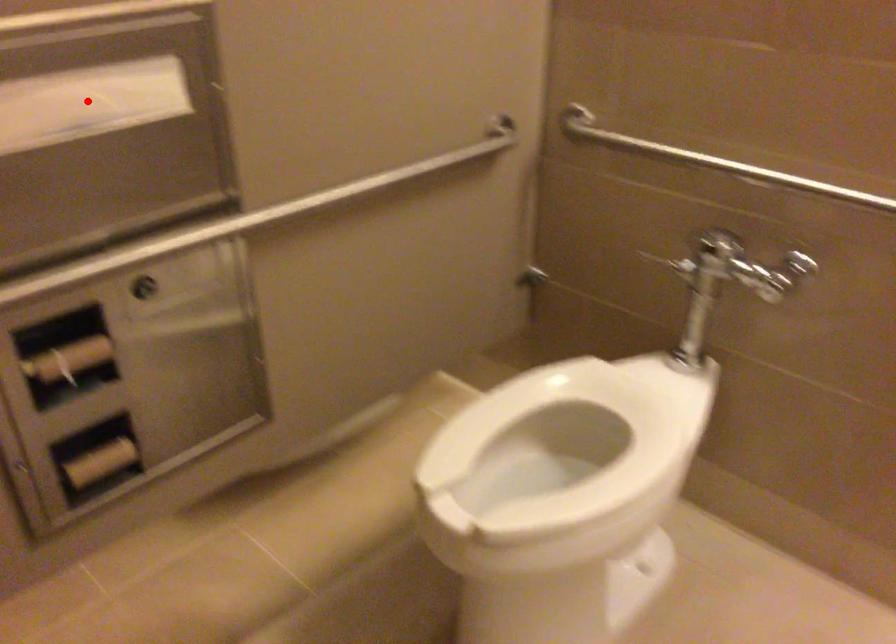
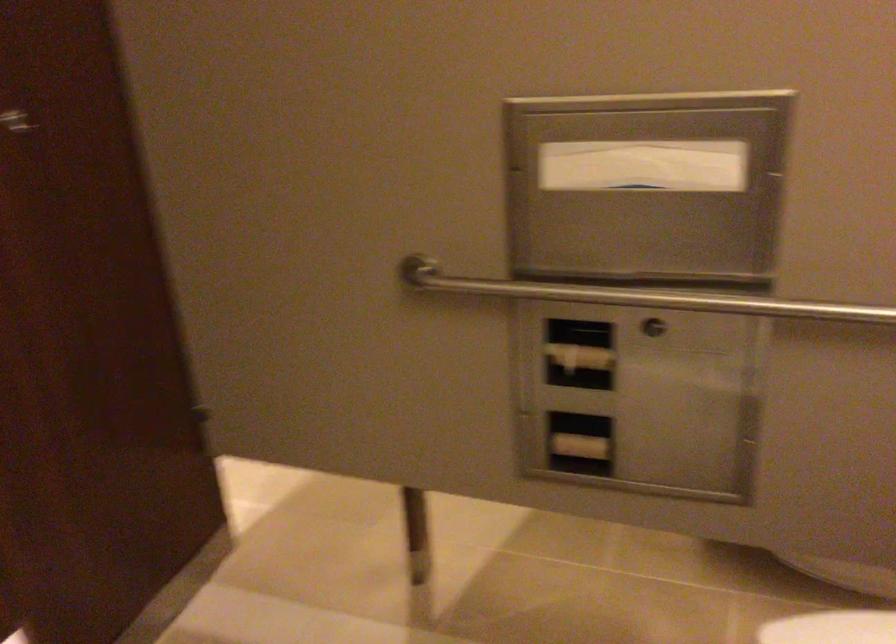
In the second image, find the point that corresponds to the highlighted location in the first image.

(643, 166)